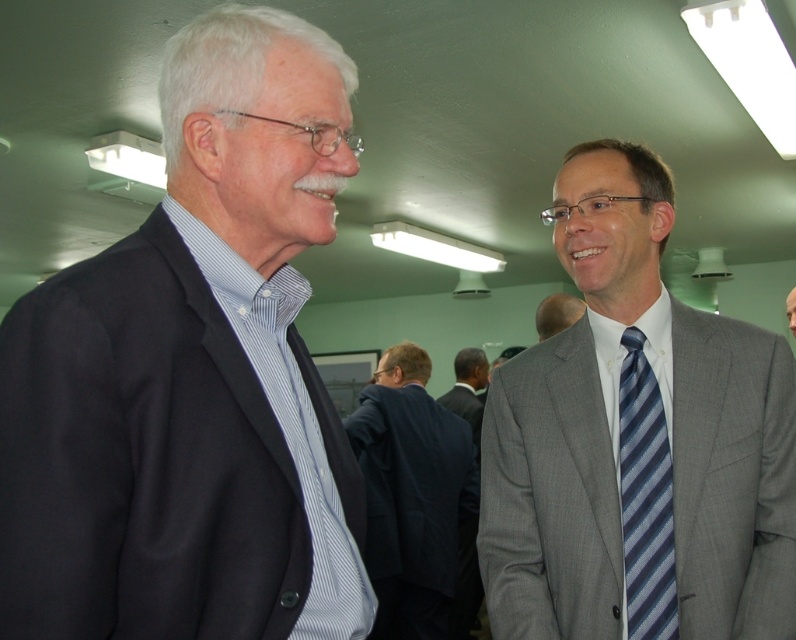
You are standing in the conference room and need to locate the dark gray suit at center. Based on the coordinates provided, can you confirm if the point marked at [467,388] is the correct location for the dark gray suit at center?

Yes, the point marked at [467,388] is the correct location for the dark gray suit at center as stated in the Objects Description.

You are organizing a photo shoot and need to ensure proper lighting for the subjects wearing the dark blue suit at center and the gray suit at right. Based on their positions in the image, which suit is closer to the floor?

The dark blue suit at center is positioned under the gray suit at right, so the dark blue suit at center is closer to the floor.